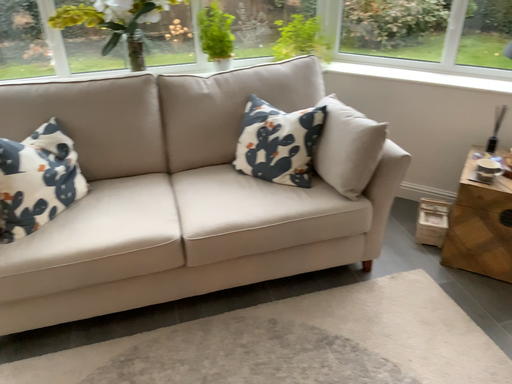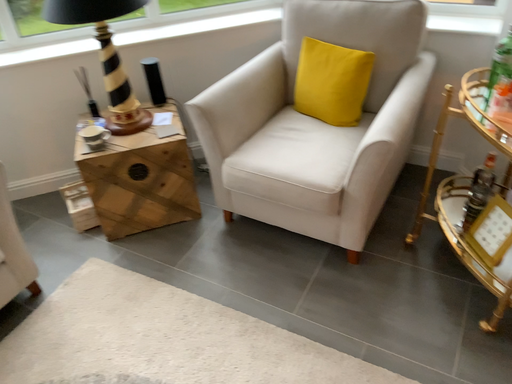
Question: How did the camera likely rotate when shooting the video?

Choices:
 (A) rotated left
 (B) rotated right

Answer: (B)